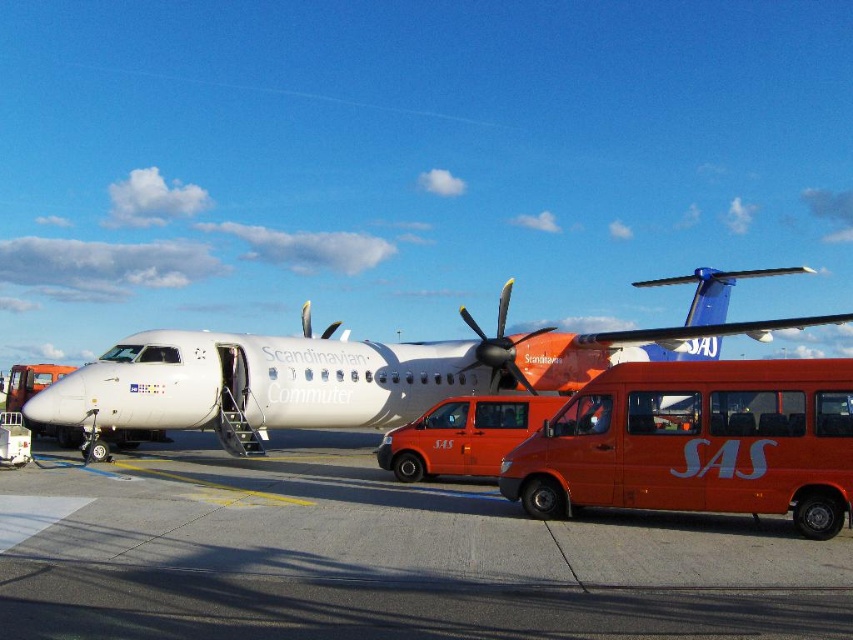
Is concrete at center to the left of yellow metallic propeller at center from the viewer's perspective?

Correct, you'll find concrete at center to the left of yellow metallic propeller at center.

Where is `concrete at center`? Image resolution: width=853 pixels, height=640 pixels. concrete at center is located at coordinates pos(381,561).

Can you confirm if matte orange van at center is taller than yellow metallic propeller at center?

In fact, matte orange van at center may be shorter than yellow metallic propeller at center.

Looking at this image, between matte orange van at center and yellow metallic propeller at center, which one is positioned higher?

yellow metallic propeller at center is higher up.

Between point (732, 433) and point (506, 362), which one is positioned in front?

Positioned in front is point (732, 433).

The width and height of the screenshot is (853, 640). Identify the location of matte orange van at center. pos(697,442).

Is orange matte van at center shorter than yellow metallic propeller at center?

Yes, orange matte van at center is shorter than yellow metallic propeller at center.

Which is below, orange matte van at center or yellow metallic propeller at center?

orange matte van at center

Who is more forward, (405, 428) or (496, 333)?

Point (405, 428) is in front.

At what (x,y) coordinates should I click in order to perform the action: click on orange matte van at center. Please return your answer as a coordinate pair (x, y). The width and height of the screenshot is (853, 640). Looking at the image, I should click on (463, 435).